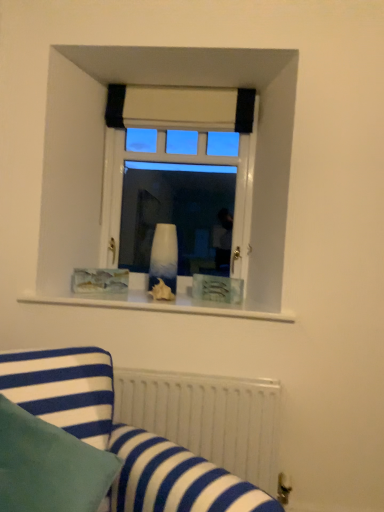
The image size is (384, 512). Describe the element at coordinates (122, 435) in the screenshot. I see `blue striped fabric at lower left` at that location.

Locate an element on the screen. This screenshot has width=384, height=512. white glossy vase at center is located at coordinates (164, 257).

Find the location of a particular element. The image size is (384, 512). white glossy vase at center is located at coordinates (178, 175).

Find the location of `blue striped fabric at lower left`. blue striped fabric at lower left is located at coordinates (122, 435).

Image resolution: width=384 pixels, height=512 pixels. Find the location of `radiator in front of the white glossy vase at center`. radiator in front of the white glossy vase at center is located at coordinates [x=207, y=417].

Between point (171, 440) and point (156, 247), which one is positioned behind?

Positioned behind is point (156, 247).

Can you confirm if white glossy vase at center is thinner than blue striped fabric at lower left?

Yes.

Which is less distant, (220, 118) or (76, 364)?

Point (220, 118) is farther from the camera than point (76, 364).

Considering the relative positions of white glossy vase at center and blue striped fabric at lower left in the image provided, is white glossy vase at center in front of blue striped fabric at lower left?

No, it is not.

Are white glossy vase at center and blue striped fabric at lower left far apart?

That's right, there is a large distance between white glossy vase at center and blue striped fabric at lower left.

Can you confirm if white glossy vase at center is thinner than white matte radiator at lower center?

Correct, the width of white glossy vase at center is less than that of white matte radiator at lower center.

From a real-world perspective, which object stands above the other?

white glossy vase at center, from a real-world perspective.

Considering the relative sizes of white glossy vase at center and white matte radiator at lower center in the image provided, is white glossy vase at center taller than white matte radiator at lower center?

In fact, white glossy vase at center may be shorter than white matte radiator at lower center.

Based on the photo, is white glossy vase at center next to white matte radiator at lower center and touching it?

white glossy vase at center and white matte radiator at lower center are clearly separated.

From a real-world perspective, which is physically below, white glossy vase at center or white glossy vase at center?

white glossy vase at center is physically lower.

Consider the image. Does white glossy vase at center have a greater width compared to white glossy vase at center?

No, white glossy vase at center is not wider than white glossy vase at center.

Is the surface of white glossy vase at center in direct contact with white glossy vase at center?

white glossy vase at center and white glossy vase at center are not in contact.

How much distance is there between white glossy vase at center and white glossy vase at center?

The distance of white glossy vase at center from white glossy vase at center is 14.17 inches.

Does white glossy vase at center appear on the left side of white matte radiator at lower center?

Indeed, white glossy vase at center is positioned on the left side of white matte radiator at lower center.

Is white glossy vase at center positioned beyond the bounds of white matte radiator at lower center?

Absolutely, white glossy vase at center is external to white matte radiator at lower center.

From a real-world perspective, does white glossy vase at center stand above white matte radiator at lower center?

Yes, from a real-world perspective, white glossy vase at center is on top of white matte radiator at lower center.

Which object is wider, white glossy vase at center or white matte radiator at lower center?

white matte radiator at lower center.

Does blue striped fabric at lower left appear on the left side of white glossy vase at center?

Indeed, blue striped fabric at lower left is positioned on the left side of white glossy vase at center.

How different are the orientations of blue striped fabric at lower left and white glossy vase at center in degrees?

They differ by 40.1 degrees in their facing directions.

Which object is thinner, blue striped fabric at lower left or white glossy vase at center?

white glossy vase at center is thinner.

From a real-world perspective, which is physically above, blue striped fabric at lower left or white glossy vase at center?

From a 3D spatial view, white glossy vase at center is above.

In the scene shown: Considering the relative sizes of white glossy vase at center and blue striped fabric at lower left in the image provided, is white glossy vase at center bigger than blue striped fabric at lower left?

No.

Is white glossy vase at center shorter than blue striped fabric at lower left?

Yes, white glossy vase at center is shorter than blue striped fabric at lower left.

This screenshot has width=384, height=512. In order to click on vase that appears above the blue striped fabric at lower left (from the image's perspective) in this screenshot , I will do `click(164, 257)`.

This screenshot has width=384, height=512. I want to click on vase on the left of the white matte radiator at lower center, so click(164, 257).

Locate an element on the screen. The height and width of the screenshot is (512, 384). window to the right of blue striped fabric at lower left is located at coordinates (178, 175).

Based on their spatial positions, is blue striped fabric at lower left or white glossy vase at center closer to white glossy vase at center?

Based on the image, white glossy vase at center appears to be nearer to white glossy vase at center.

When comparing their distances from white matte radiator at lower center, does blue striped fabric at lower left or white glossy vase at center seem further?

white glossy vase at center lies further to white matte radiator at lower center than the other object.

Based on their spatial positions, is white matte radiator at lower center or white glossy vase at center closer to white glossy vase at center?

white glossy vase at center is closer to white glossy vase at center.

Considering their positions, is white glossy vase at center positioned closer to white matte radiator at lower center than blue striped fabric at lower left?

Among the two, blue striped fabric at lower left is located nearer to white matte radiator at lower center.

When comparing their distances from white glossy vase at center, does white matte radiator at lower center or white glossy vase at center seem closer?

white glossy vase at center is closer to white glossy vase at center.

Considering their positions, is blue striped fabric at lower left positioned closer to white glossy vase at center than white matte radiator at lower center?

The object closer to white glossy vase at center is white matte radiator at lower center.

In the scene shown: When comparing their distances from blue striped fabric at lower left, does white matte radiator at lower center or white glossy vase at center seem closer?

white matte radiator at lower center lies closer to blue striped fabric at lower left than the other object.

Estimate the real-world distances between objects in this image. Which object is closer to white matte radiator at lower center, blue striped fabric at lower left or white glossy vase at center?

blue striped fabric at lower left is positioned closer to the anchor white matte radiator at lower center.

You are a GUI agent. You are given a task and a screenshot of the screen. Output one action in this format:
    pyautogui.click(x=<x>, y=<y>)
    Task: Click on the radiator between blue striped fabric at lower left and white glossy vase at center in the front-back direction
    The height and width of the screenshot is (512, 384).
    Given the screenshot: What is the action you would take?
    [x=207, y=417]

At what (x,y) coordinates should I click in order to perform the action: click on vase between white glossy vase at center and white matte radiator at lower center in the vertical direction. Please return your answer as a coordinate pair (x, y). Looking at the image, I should click on (164, 257).

Locate an element on the screen. radiator located between blue striped fabric at lower left and white glossy vase at center in the depth direction is located at coordinates (207, 417).

Locate an element on the screen. vase located between blue striped fabric at lower left and white glossy vase at center in the depth direction is located at coordinates (164, 257).